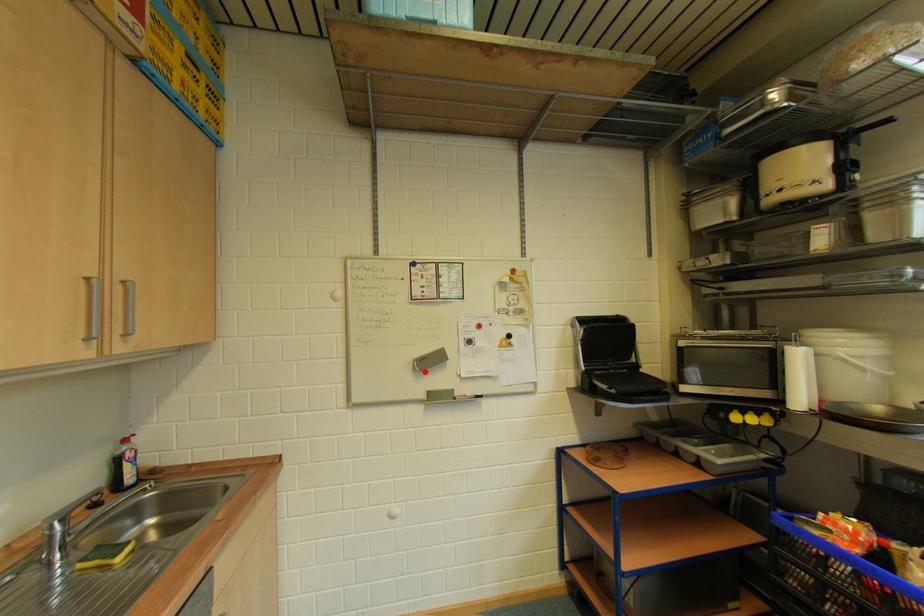
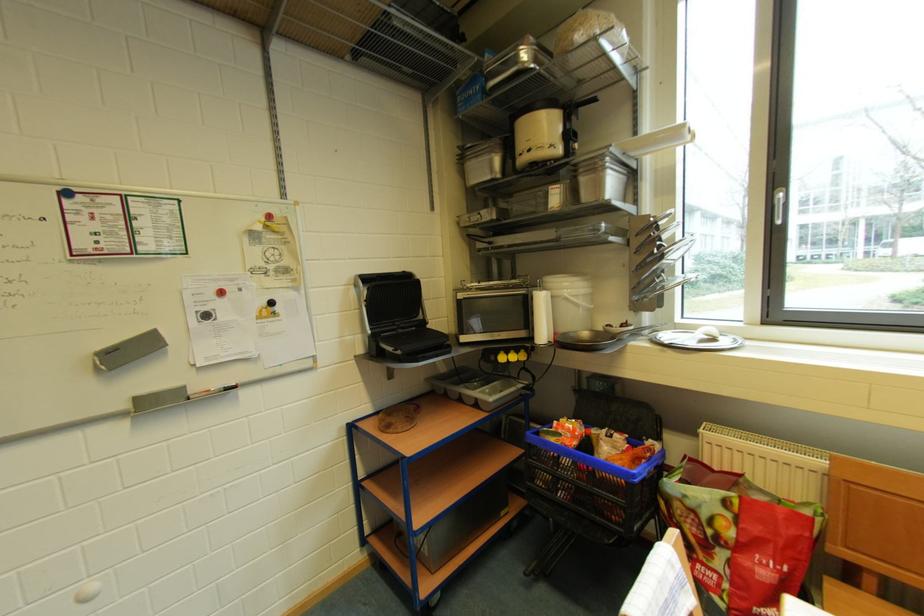
In the second image, find the point that corresponds to the highlighted location in the first image.

(110, 370)